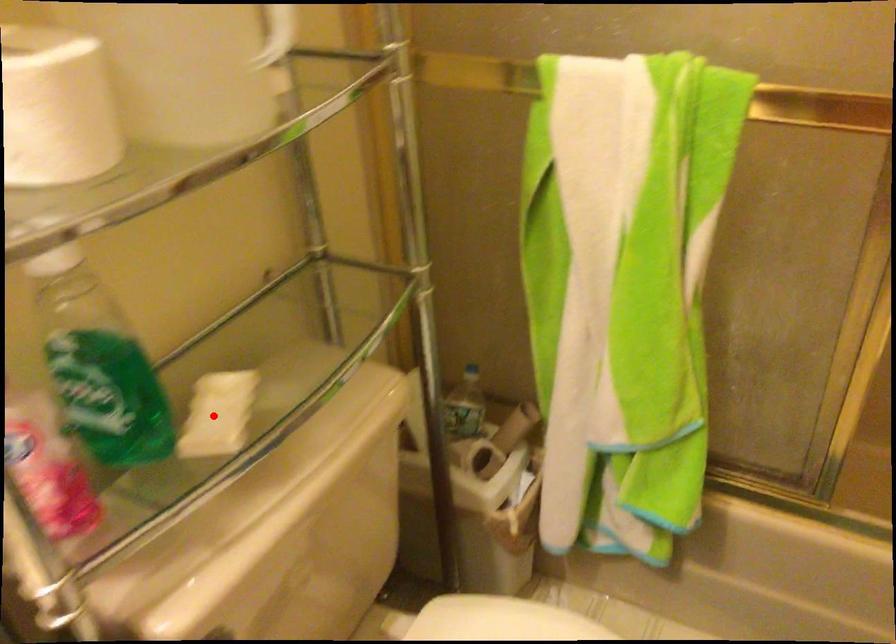
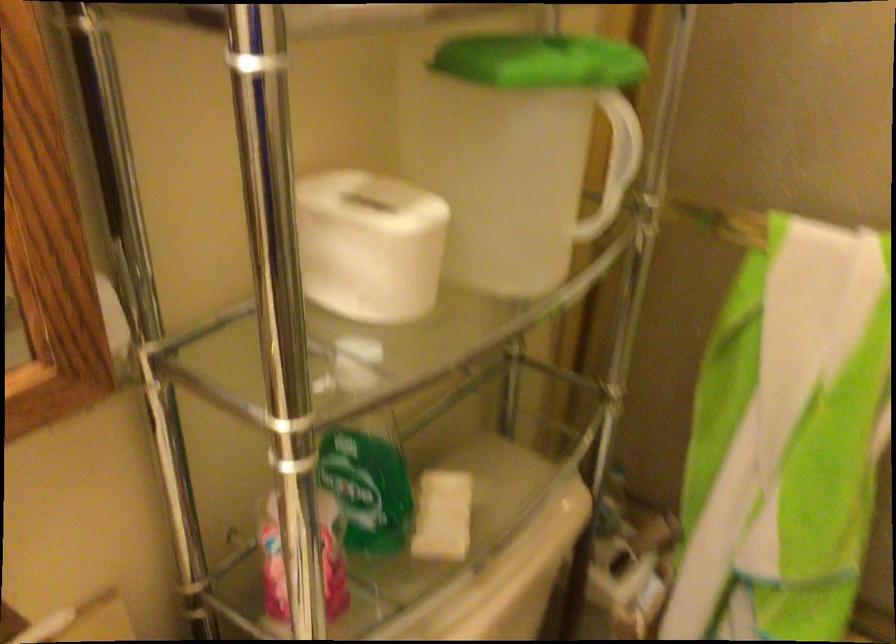
Find the pixel in the second image that matches the highlighted location in the first image.

(442, 516)